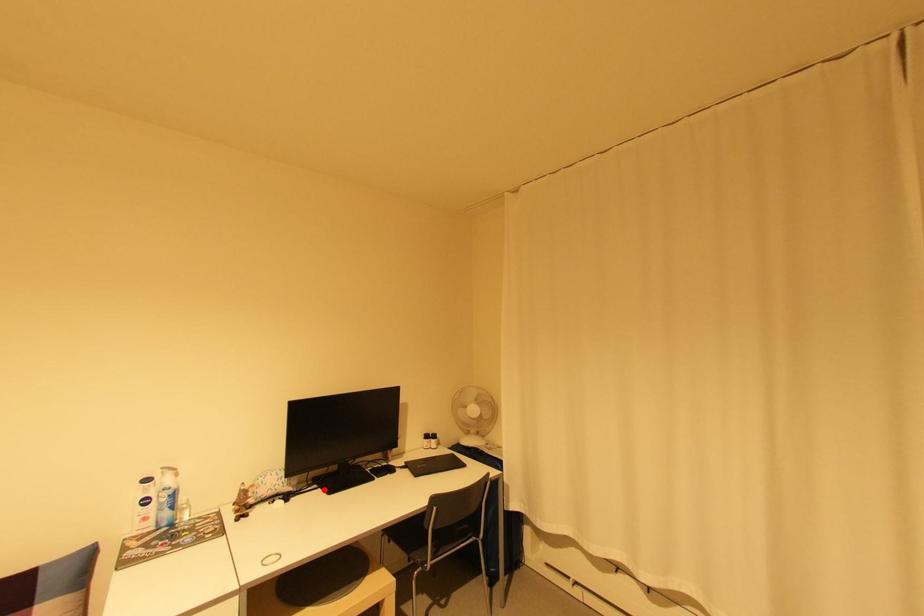
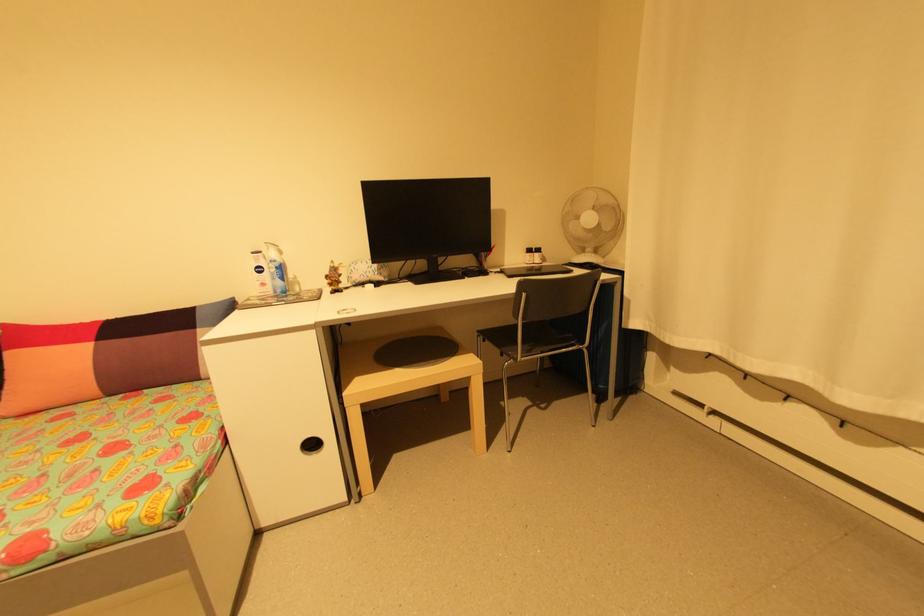
In the second image, find the point that corresponds to the highlighted location in the first image.

(414, 283)